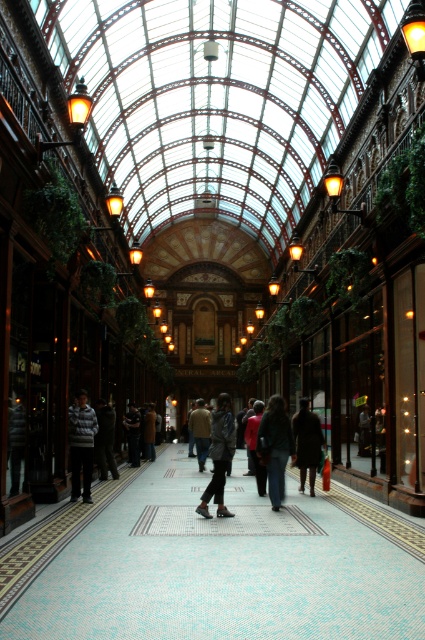
Question: Is dark gray jacket at center bigger than dark brown leather jacket at center?

Choices:
 (A) yes
 (B) no

Answer: (A)

Question: Can you confirm if denim jeans at center is positioned above light brown leather jacket at center?

Choices:
 (A) no
 (B) yes

Answer: (B)

Question: Which object is farther from the camera taking this photo?

Choices:
 (A) brown woolen sweater at center
 (B) striped sweater at center
 (C) dark gray jacket at center
 (D) denim jeans at center

Answer: (A)

Question: Among these objects, which one is farthest from the camera?

Choices:
 (A) denim jeans at center
 (B) dark gray fabric jacket at center
 (C) brown woolen sweater at center

Answer: (C)

Question: Is denim jeans at center thinner than red fabric jacket at center?

Choices:
 (A) yes
 (B) no

Answer: (B)

Question: Which object is farther from the camera taking this photo?

Choices:
 (A) red fabric jacket at center
 (B) dark brown leather coat at center
 (C) dark gray jacket at center

Answer: (C)